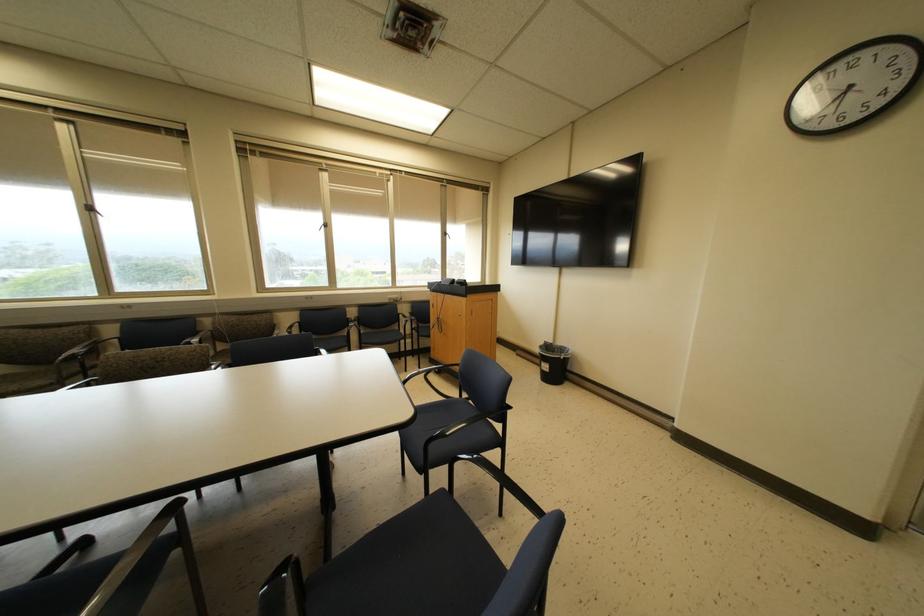
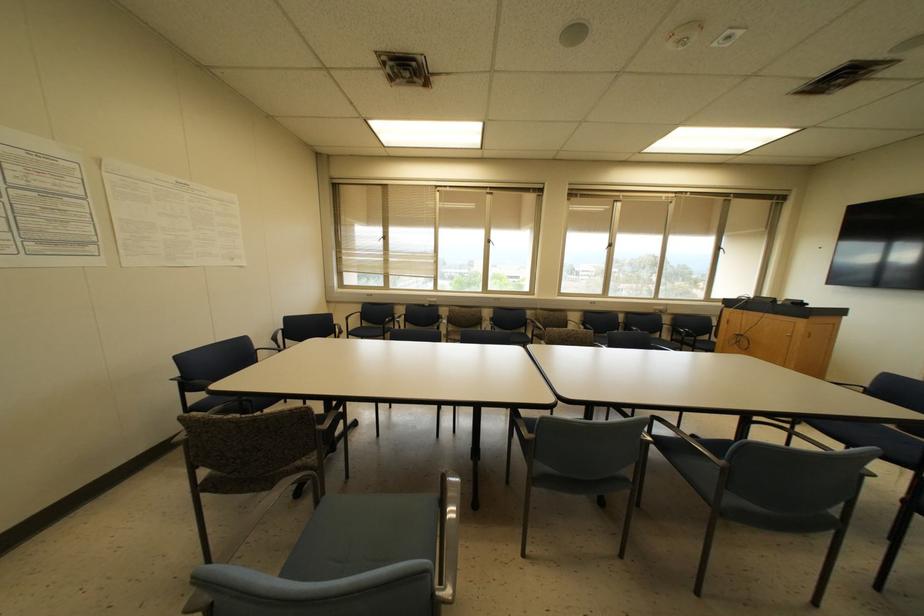
The images are taken continuously from a first-person perspective. In which direction are you moving?

The movement direction of the cameraman is left, backward.